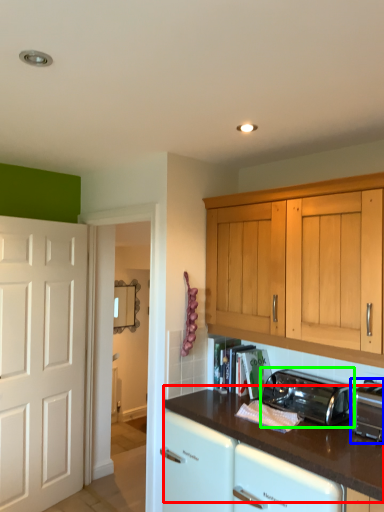
Question: Which object is the farthest from countertop (highlighted by a red box)? Choose among these: toaster (highlighted by a blue box) or toaster (highlighted by a green box).

Choices:
 (A) toaster
 (B) toaster

Answer: (A)